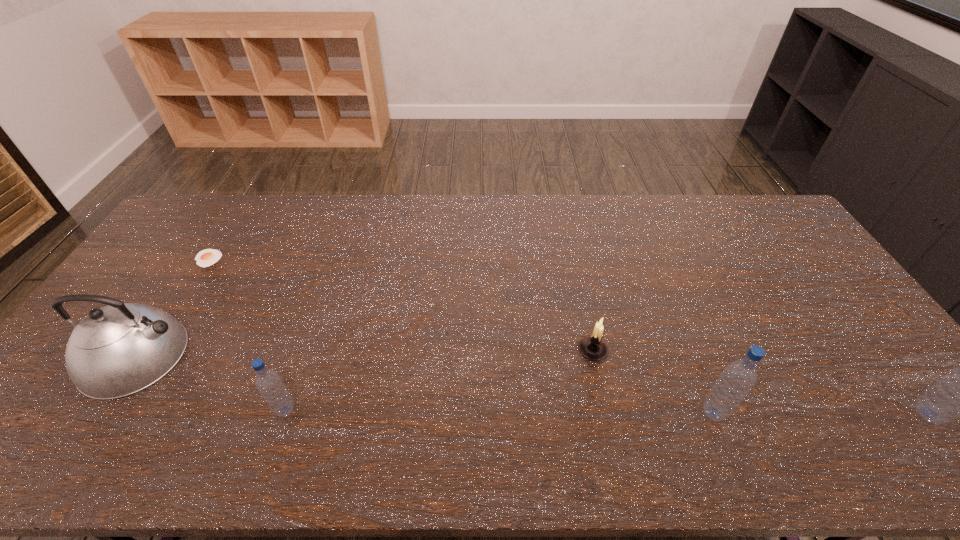
Locate an element on the screen. The image size is (960, 540). object that is at the right edge is located at coordinates (959, 394).

At what (x,y) coordinates should I click in order to perform the action: click on object present at the near left corner. Please return your answer as a coordinate pair (x, y). The image size is (960, 540). Looking at the image, I should click on (117, 350).

This screenshot has height=540, width=960. In order to click on object positioned at the near right corner in this screenshot , I will do `click(959, 394)`.

Image resolution: width=960 pixels, height=540 pixels. I want to click on free space at the far edge of the desktop, so click(x=616, y=227).

The image size is (960, 540). I want to click on free space at the near edge of the desktop, so click(x=651, y=388).

Find the location of a particular element. free region at the left edge of the desktop is located at coordinates (155, 266).

I want to click on vacant space at the right edge of the desktop, so click(783, 253).

Where is `vacant space at the far right corner of the desktop`? The height and width of the screenshot is (540, 960). vacant space at the far right corner of the desktop is located at coordinates (752, 197).

At what (x,y) coordinates should I click in order to perform the action: click on empty space that is in between the egg yolk and the tallest object. Please return your answer as a coordinate pair (x, y). The width and height of the screenshot is (960, 540). Looking at the image, I should click on (568, 336).

Identify the location of vacant space that is in between the kettle and the third shortest object. point(211,383).